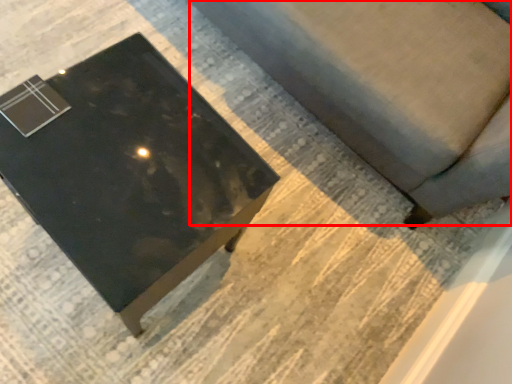
Question: From the image's perspective, what is the correct spatial positioning of couch (annotated by the red box) in reference to table?

Choices:
 (A) above
 (B) below

Answer: (A)